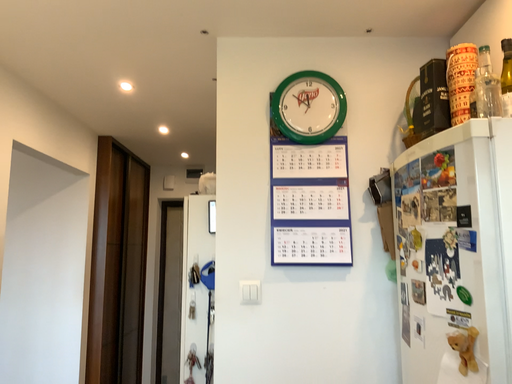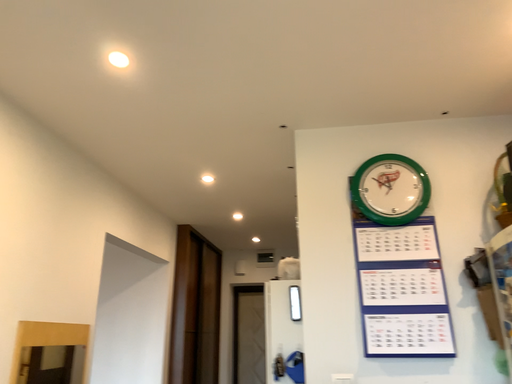
Question: Which way did the camera rotate in the video?

Choices:
 (A) rotated right
 (B) rotated left

Answer: (B)